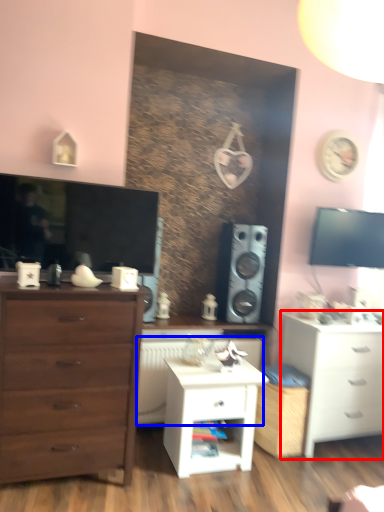
Question: Which object is further to the camera taking this photo, chest of drawers (highlighted by a red box) or radiator (highlighted by a blue box)?

Choices:
 (A) chest of drawers
 (B) radiator

Answer: (B)